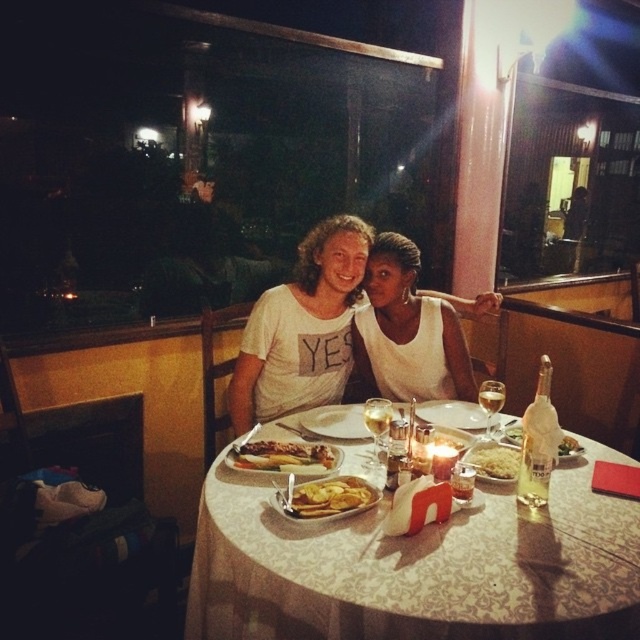
Can you confirm if matte glass plate at center is positioned below translucent glass bottle at right?

No, matte glass plate at center is not below translucent glass bottle at right.

Who is more forward, (273, 468) or (570, 449)?

Point (273, 468)

Is point (304, 476) behind point (573, 444)?

No.

Where is `matte glass plate at center`? This screenshot has height=640, width=640. matte glass plate at center is located at coordinates (332, 424).

Is point (264, 550) in front of point (310, 456)?

Yes, point (264, 550) is closer to viewer.

Does white lace tablecloth at center have a lesser width compared to golden crispy chicken at center?

In fact, white lace tablecloth at center might be wider than golden crispy chicken at center.

Identify the location of white lace tablecloth at center. (417, 566).

Identify the location of white lace tablecloth at center. (417, 566).

Does white cotton shirt at center have a greater height compared to golden crispy chicken at center?

Indeed, white cotton shirt at center has a greater height compared to golden crispy chicken at center.

Is point (337, 228) positioned after point (234, 464)?

Yes, point (337, 228) is behind point (234, 464).

Does point (243, 429) lie in front of point (307, 442)?

That is False.

The height and width of the screenshot is (640, 640). What are the coordinates of `white cotton shirt at center` in the screenshot? It's located at (301, 328).